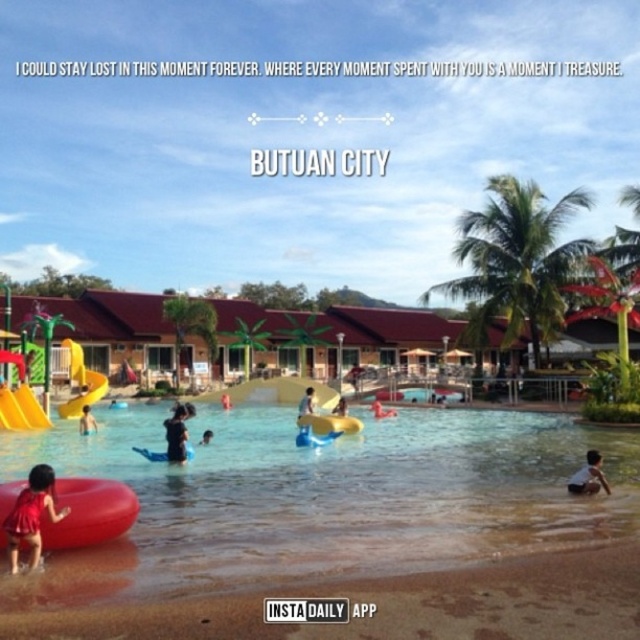
Question: Does matte yellow float at center lie behind smooth yellow float at center?

Choices:
 (A) no
 (B) yes

Answer: (B)

Question: Which object is the farthest from the yellow matte slide at lower left?

Choices:
 (A) matte black swimsuit at center
 (B) black matte swimsuit at center
 (C) yellow plastic slide at lower left

Answer: (B)

Question: Can you confirm if yellow matte slide at lower left is positioned below smooth skin person at lower center?

Choices:
 (A) no
 (B) yes

Answer: (A)

Question: Considering the real-world distances, which object is closest to the matte black swimsuit at center?

Choices:
 (A) matte yellow float at center
 (B) light brown skin at lower right
 (C) yellow plastic slide at lower left

Answer: (C)

Question: Which object is positioned closest to the clear water at center?

Choices:
 (A) matte black swimsuit at center
 (B) smooth skin person at lower center
 (C) matte red swimsuit at lower left

Answer: (B)

Question: Observing the image, what is the correct spatial positioning of matte red swimsuit at lower left in reference to matte black swimsuit at center?

Choices:
 (A) below
 (B) above

Answer: (B)